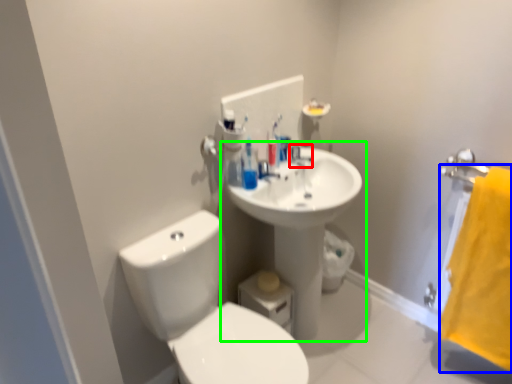
Question: Considering the real-world distances, which object is farthest from plumbing fixture (highlighted by a red box)? beach towel (highlighted by a blue box) or sink (highlighted by a green box)?

Choices:
 (A) beach towel
 (B) sink

Answer: (A)